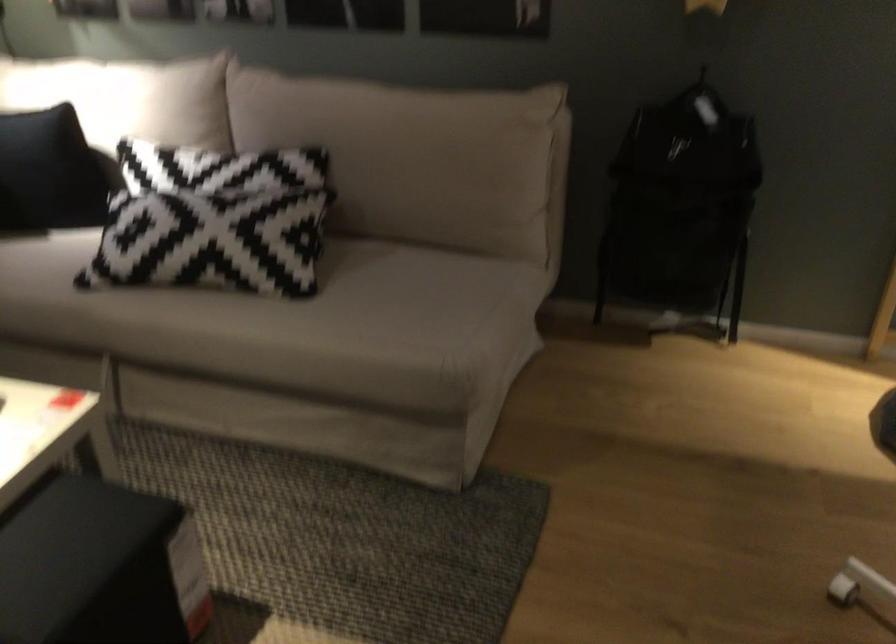
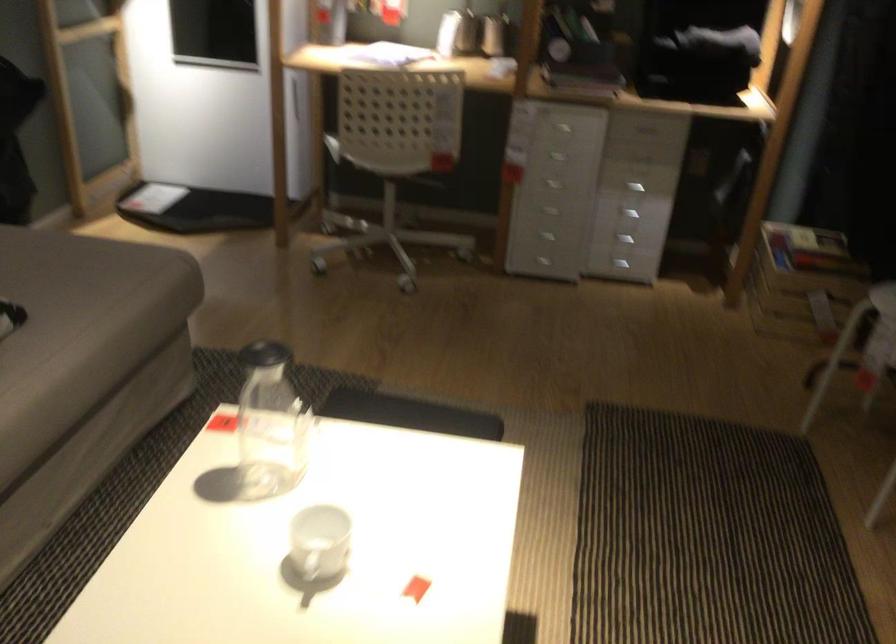
The point at (x=92, y=444) is marked in the first image. Where is the corresponding point in the second image?

(270, 424)